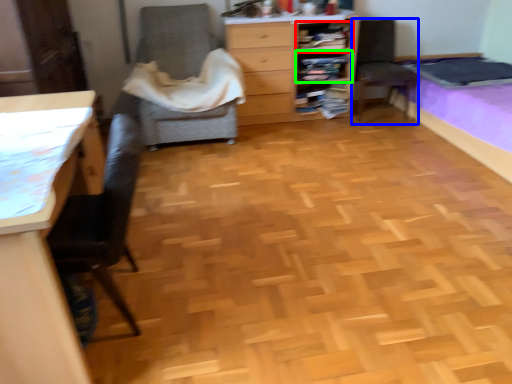
Question: Which object is the farthest from shelf (highlighted by a red box)? Choose among these: chair (highlighted by a blue box) or shelf (highlighted by a green box).

Choices:
 (A) chair
 (B) shelf

Answer: (A)